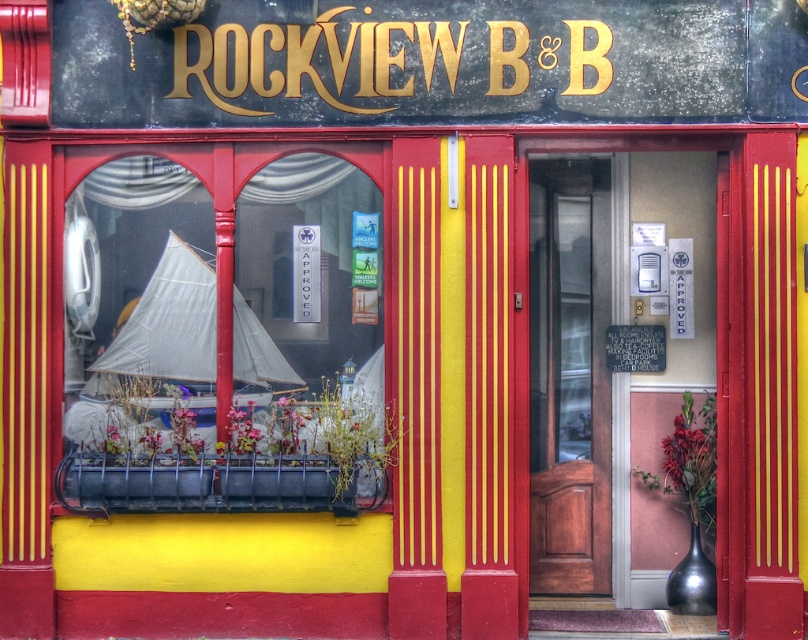
Question: Which object is farther from the camera taking this photo?

Choices:
 (A) gold metallic sign at upper center
 (B) mahogany wood door at center
 (C) wooden door at center

Answer: (B)

Question: Which point is farther to the camera?

Choices:
 (A) gold metallic sign at upper center
 (B) wooden door at center
 (C) mahogany wood door at center

Answer: (C)

Question: Does mahogany wood door at center have a larger size compared to gold metallic sign at upper center?

Choices:
 (A) no
 (B) yes

Answer: (B)

Question: Based on their relative distances, which object is nearer to the gold metallic sign at upper center?

Choices:
 (A) mahogany wood door at center
 (B) wooden door at center

Answer: (A)

Question: Does wooden door at center come behind mahogany wood door at center?

Choices:
 (A) no
 (B) yes

Answer: (A)

Question: Is wooden door at center below gold metallic sign at upper center?

Choices:
 (A) no
 (B) yes

Answer: (B)